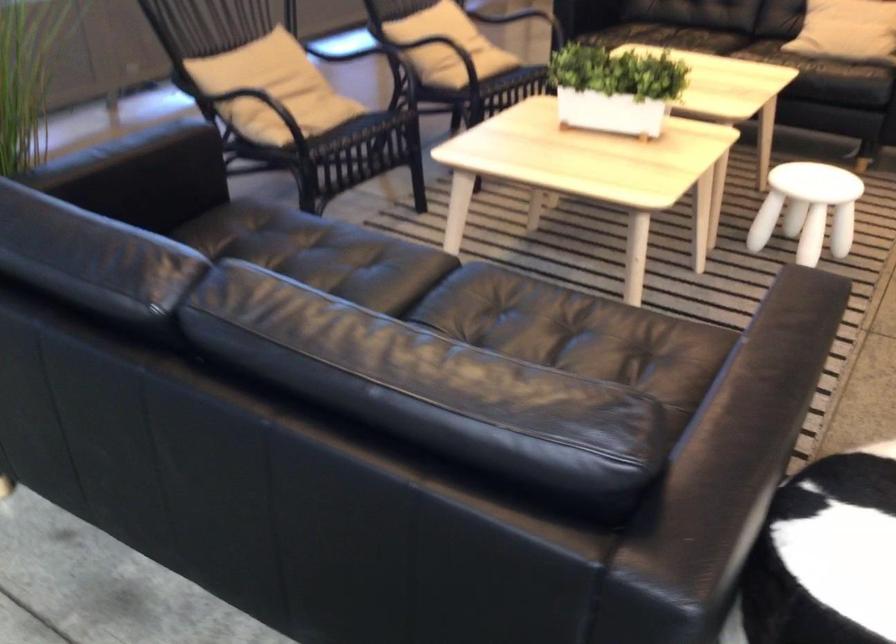
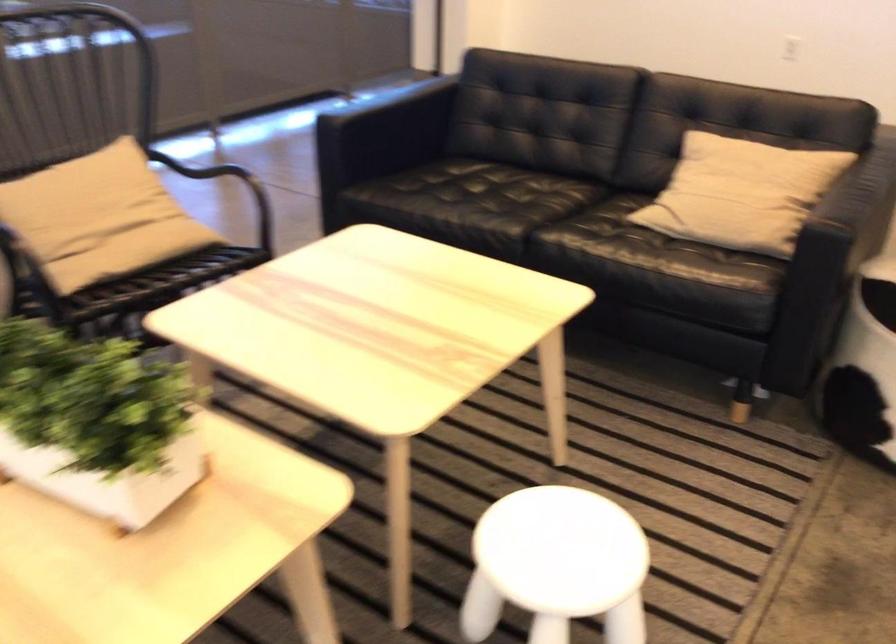
In a continuous first-person perspective shot, in which direction is the camera moving?

The cameraman moved toward right, forward.